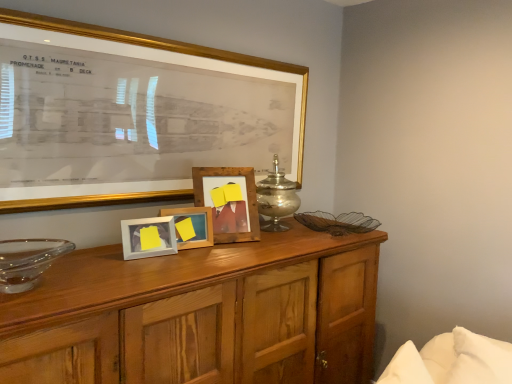
At what (x,y) coordinates should I click in order to perform the action: click on empty space that is to the right of white matte picture frame at center, which appears as the 2th picture frame when viewed from the front. Please return your answer as a coordinate pair (x, y). Looking at the image, I should click on [195, 252].